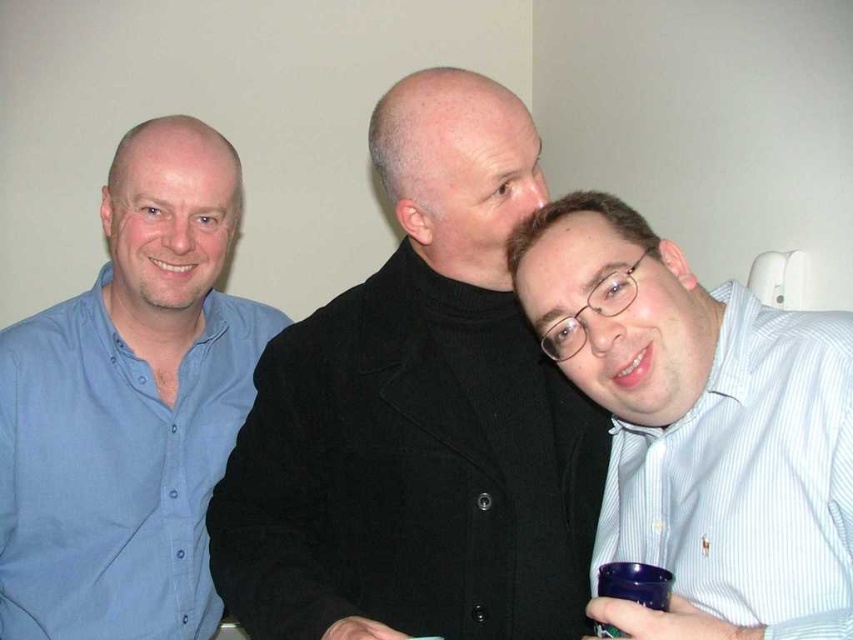
Which is in front, point (215, 561) or point (45, 356)?

Point (215, 561)

Does black matte coat at center appear under blue cotton shirt at left?

Incorrect, black matte coat at center is not positioned below blue cotton shirt at left.

Find the location of a particular element. The image size is (853, 640). black matte coat at center is located at coordinates (418, 416).

Locate an element on the screen. This screenshot has width=853, height=640. black matte coat at center is located at coordinates (418, 416).

Who is lower down, white striped shirt at right or blue plastic cup at lower right?

blue plastic cup at lower right is below.

Who is taller, white striped shirt at right or blue plastic cup at lower right?

white striped shirt at right

You are a GUI agent. You are given a task and a screenshot of the screen. Output one action in this format:
    pyautogui.click(x=<x>, y=<y>)
    Task: Click on the white striped shirt at right
    
    Given the screenshot: What is the action you would take?
    pyautogui.click(x=700, y=426)

Does blue cotton shirt at left have a larger size compared to blue plastic cup at lower right?

Indeed, blue cotton shirt at left has a larger size compared to blue plastic cup at lower right.

Between point (138, 582) and point (608, 564), which one is positioned behind?

Positioned behind is point (138, 582).

The height and width of the screenshot is (640, 853). Find the location of `blue cotton shirt at left`. blue cotton shirt at left is located at coordinates (129, 406).